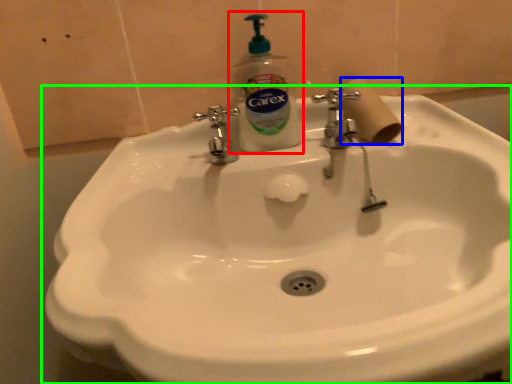
Question: Which object is the closest to the soap dispenser (highlighted by a red box)? Choose among these: toilet paper (highlighted by a blue box) or sink (highlighted by a green box).

Choices:
 (A) toilet paper
 (B) sink

Answer: (A)